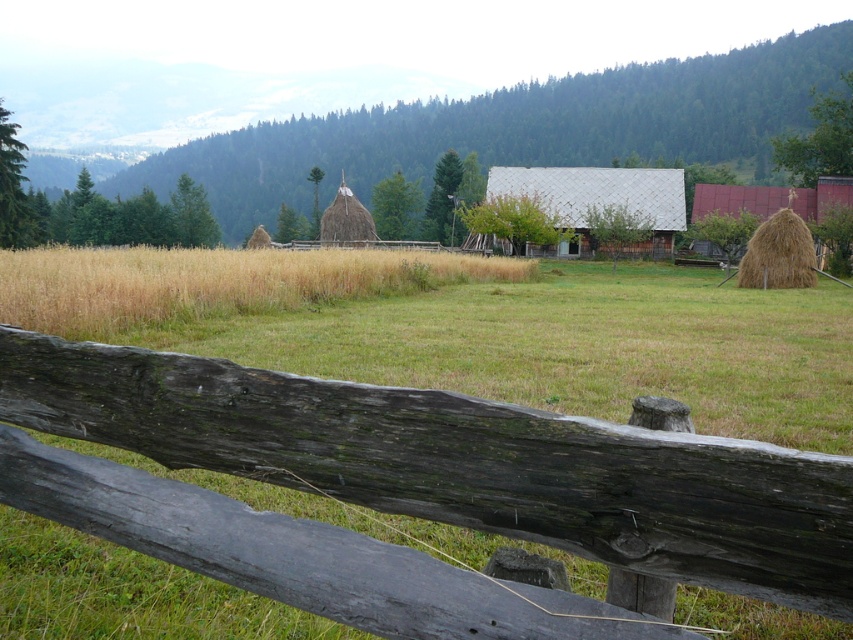
You are standing at the origin point of the image. Which direction should you move to reach the weathered wood fence at center?

The weathered wood fence at center is located at coordinates point (550, 474), so you should move towards the direction of increasing x and y coordinates to reach it.

You are a farmer checking the field. You see the yellow dry grass at center and the brown straw bale at right. Which object is closer to the ground?

The yellow dry grass at center is located below brown straw bale at right, so the yellow dry grass at center is closer to the ground.

You are standing in the rural landscape and want to place a new garden sign between the weathered wood fence at center and the brown straw bale at right. Based on their positions, which object should the sign be closer to?

The weathered wood fence at center is closer to the viewer than the brown straw bale at right, so the garden sign should be placed closer to the weathered wood fence at center to maintain proximity to the foreground elements.